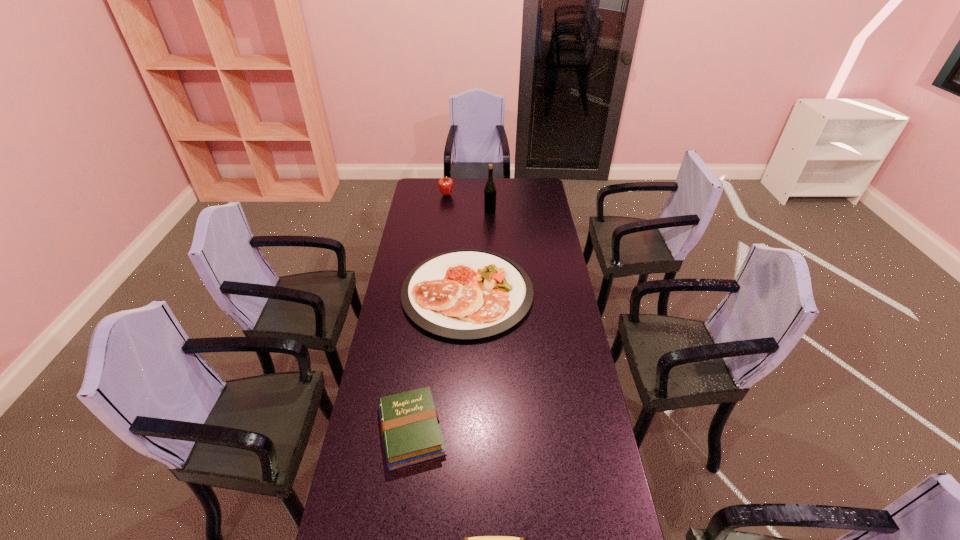
At what (x,y) coordinates should I click in order to perform the action: click on object at the far edge. Please return your answer as a coordinate pair (x, y). This screenshot has width=960, height=540. Looking at the image, I should click on (445, 184).

Where is `apple present at the left edge`? The image size is (960, 540). apple present at the left edge is located at coordinates (445, 184).

Find the location of a particular element. dish that is at the left edge is located at coordinates (467, 294).

Identify the location of book that is positioned at the left edge. This screenshot has height=540, width=960. (410, 427).

Locate an element on the screen. The height and width of the screenshot is (540, 960). object positioned at the right edge is located at coordinates (467, 294).

This screenshot has width=960, height=540. In order to click on object positioned at the far left corner in this screenshot , I will do `click(445, 184)`.

Where is `vacant space at the far edge of the desktop`? vacant space at the far edge of the desktop is located at coordinates (474, 189).

Where is `free space at the left edge`? free space at the left edge is located at coordinates (406, 222).

Locate an element on the screen. vacant space at the right edge of the desktop is located at coordinates (547, 211).

Identify the location of free spot at the far left corner of the desktop. This screenshot has width=960, height=540. point(437,186).